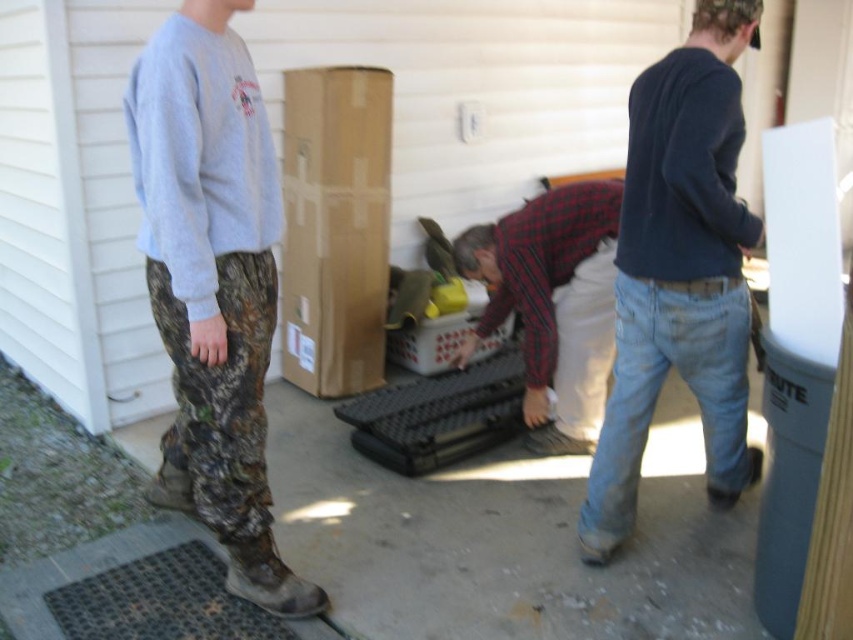
Question: Which point is farther to the camera?

Choices:
 (A) (618, 184)
 (B) (357, 220)
 (C) (231, 422)
 (D) (717, 147)

Answer: (B)

Question: Is dark blue sweater at center positioned behind plaid shirt at center?

Choices:
 (A) yes
 (B) no

Answer: (B)

Question: Considering the relative positions of dark blue sweater at center and plaid shirt at center in the image provided, where is dark blue sweater at center located with respect to plaid shirt at center?

Choices:
 (A) left
 (B) right

Answer: (B)

Question: Which point is farther to the camera?

Choices:
 (A) (572, 438)
 (B) (227, 433)
 (C) (660, 266)

Answer: (A)

Question: Which object is closer to the camera taking this photo?

Choices:
 (A) plaid shirt at center
 (B) brown cardboard box at center
 (C) dark blue sweater at center

Answer: (C)

Question: Does camo pants at left appear over brown cardboard box at center?

Choices:
 (A) no
 (B) yes

Answer: (A)